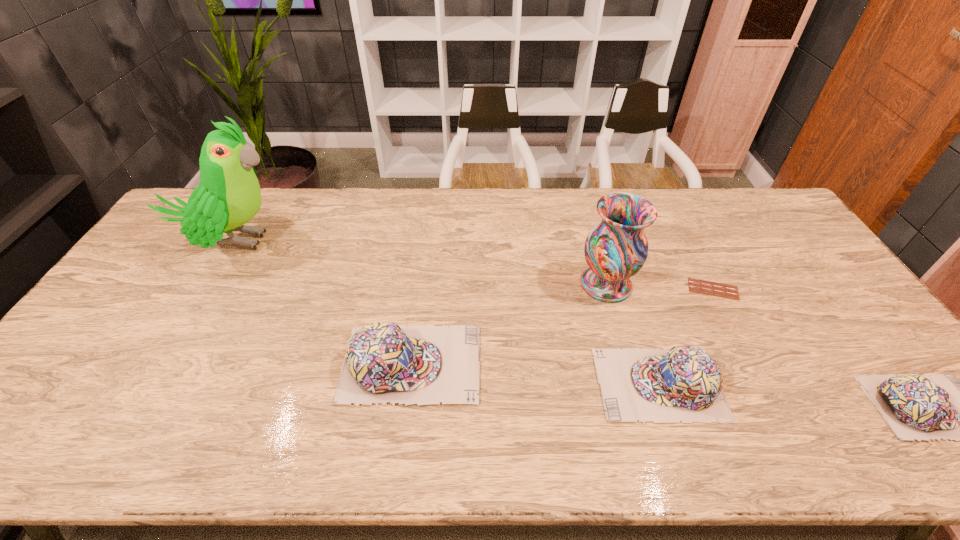
In order to click on vacant space located on the front, side, and top of the second shortest cap in this screenshot , I will do `click(533, 384)`.

Identify the location of vacant position located 0.380m on the front, side, and top of the second shortest cap. (443, 384).

At what (x,y) coordinates should I click in order to perform the action: click on vacant space located 0.190m on the front of the fifth object from left to right. Please return your answer as a coordinate pair (x, y). This screenshot has height=540, width=960. Looking at the image, I should click on (747, 355).

This screenshot has height=540, width=960. Find the location of `vacant space situated 0.330m on the beak of the leftmost object`. vacant space situated 0.330m on the beak of the leftmost object is located at coordinates (391, 241).

In order to click on free location located on the front of the vase in this screenshot , I will do `click(640, 408)`.

Image resolution: width=960 pixels, height=540 pixels. What are the coordinates of `object located at the far edge` in the screenshot? It's located at (228, 196).

Identify the location of object located in the left edge section of the desktop. (228, 196).

The image size is (960, 540). Find the location of `object at the far left corner`. object at the far left corner is located at coordinates (228, 196).

In the image, there is a desktop. Where is `vacant region at the far edge`? The height and width of the screenshot is (540, 960). vacant region at the far edge is located at coordinates (493, 187).

Where is `vacant area at the near edge`? The image size is (960, 540). vacant area at the near edge is located at coordinates (789, 396).